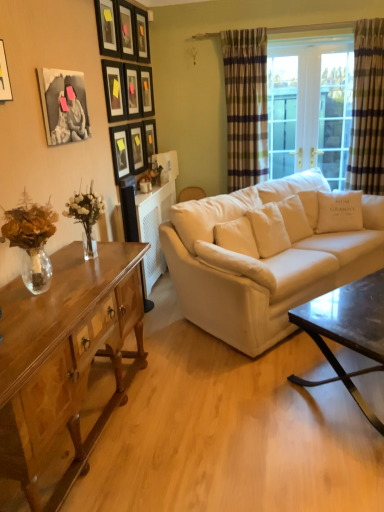
In order to face white cotton cushion at center, the 1th pillow from the right, should I rotate leftwards or rightwards?

Turn right by 19.022 degrees to look at white cotton cushion at center, the 1th pillow from the right.

In order to face matte black picture frame at upper left, marked as the second picture frame in a front-to-back arrangement, should I rotate leftwards or rightwards?

You should rotate left by 10.952 degrees.

What do you see at coordinates (137, 147) in the screenshot? The image size is (384, 512). I see `matte black picture frame at upper center, which ranks as the 4th picture frame in back-to-front order` at bounding box center [137, 147].

The image size is (384, 512). Describe the element at coordinates (150, 138) in the screenshot. I see `matte black picture frame at center, which is the tenth picture frame in front-to-back order` at that location.

Measure the distance between white fabric couch at center and camera.

8.41 feet.

Where is `white cotton cushion at center, marked as the 1th pillow in a back-to-front arrangement`? white cotton cushion at center, marked as the 1th pillow in a back-to-front arrangement is located at coordinates (339, 212).

Does point (134, 98) come behind point (107, 29)?

Yes.

From a real-world perspective, is matte black picture frame at upper center, the fifth picture frame positioned from the back, below matte black picture frame at upper left, marked as the 9th picture frame in a back-to-front arrangement?

Correct, in the physical world, matte black picture frame at upper center, the fifth picture frame positioned from the back, is lower than matte black picture frame at upper left, marked as the 9th picture frame in a back-to-front arrangement.

Is matte black picture frame at upper center, positioned as the sixth picture frame in front-to-back order, wider or thinner than matte black picture frame at upper left, marked as the second picture frame in a front-to-back arrangement?

Clearly, matte black picture frame at upper center, positioned as the sixth picture frame in front-to-back order, has less width compared to matte black picture frame at upper left, marked as the second picture frame in a front-to-back arrangement.

What's the angular difference between matte black picture frame at upper center, positioned as the sixth picture frame in front-to-back order, and matte black picture frame at upper left, marked as the 9th picture frame in a back-to-front arrangement,'s facing directions?

matte black picture frame at upper center, positioned as the sixth picture frame in front-to-back order, and matte black picture frame at upper left, marked as the 9th picture frame in a back-to-front arrangement, are facing 0.00313 degrees away from each other.

Is clear glass door at upper right wider than white cotton cushion at center, the second pillow positioned from the bottom?

In fact, clear glass door at upper right might be narrower than white cotton cushion at center, the second pillow positioned from the bottom.

From a real-world perspective, is clear glass door at upper right over white cotton cushion at center, marked as the 1th pillow in a back-to-front arrangement?

Indeed, from a real-world perspective, clear glass door at upper right stands above white cotton cushion at center, marked as the 1th pillow in a back-to-front arrangement.

Is clear glass door at upper right situated inside white cotton cushion at center, the 1th pillow from the right, or outside?

clear glass door at upper right is not enclosed by white cotton cushion at center, the 1th pillow from the right.

Is clear glass door at upper right facing towards white cotton cushion at center, arranged as the 2th pillow when viewed from the left?

Yes, clear glass door at upper right faces towards white cotton cushion at center, arranged as the 2th pillow when viewed from the left.

Can you tell me how much matte black picture frame at upper center, positioned as the sixth picture frame in front-to-back order, and plaid fabric curtain at right, the 2th curtain viewed from the right, differ in facing direction?

The facing directions of matte black picture frame at upper center, positioned as the sixth picture frame in front-to-back order, and plaid fabric curtain at right, the 2th curtain viewed from the right, are 88.6 degrees apart.

From a real-world perspective, which object rests below the other?

plaid fabric curtain at right, the 2th curtain viewed from the right.

Is matte black picture frame at upper center, positioned as the sixth picture frame in front-to-back order, next to plaid fabric curtain at right, the 2th curtain viewed from the right, and touching it?

No, matte black picture frame at upper center, positioned as the sixth picture frame in front-to-back order, is not beside plaid fabric curtain at right, the 2th curtain viewed from the right.

Between matte black picture frame at upper center, positioned as the sixth picture frame in front-to-back order, and plaid fabric curtain at right, the 2th curtain viewed from the right, which one appears on the left side from the viewer's perspective?

matte black picture frame at upper center, positioned as the sixth picture frame in front-to-back order.

Consider the image. Is matte black picture frame at upper center, positioned as the eighth picture frame in back-to-front order, wider or thinner than matte black picture frame at upper center, the third picture frame from the back?

Considering their sizes, matte black picture frame at upper center, positioned as the eighth picture frame in back-to-front order, looks slimmer than matte black picture frame at upper center, the third picture frame from the back.

Are matte black picture frame at upper center, marked as the third picture frame in a front-to-back arrangement, and matte black picture frame at upper center, the third picture frame from the back, making contact?

matte black picture frame at upper center, marked as the third picture frame in a front-to-back arrangement, and matte black picture frame at upper center, the third picture frame from the back, are clearly separated.

Is matte black picture frame at upper center, marked as the third picture frame in a front-to-back arrangement, oriented away from matte black picture frame at upper center, the third picture frame from the back?

matte black picture frame at upper center, marked as the third picture frame in a front-to-back arrangement, does not have its back to matte black picture frame at upper center, the third picture frame from the back.

Where is `window screen on the right of the matte black picture frame at upper center, which appears as the ninth picture frame when viewed from the front`? window screen on the right of the matte black picture frame at upper center, which appears as the ninth picture frame when viewed from the front is located at coordinates (310, 111).

Based on the photo, is clear glass door at upper right touching matte black picture frame at upper center, which appears as the ninth picture frame when viewed from the front?

clear glass door at upper right and matte black picture frame at upper center, which appears as the ninth picture frame when viewed from the front, are not in contact.

Is clear glass door at upper right oriented towards matte black picture frame at upper center, which is counted as the second picture frame, starting from the back?

No.

Does clear glass door at upper right have a lesser width compared to matte black picture frame at upper center, which is counted as the second picture frame, starting from the back?

Incorrect, the width of clear glass door at upper right is not less than that of matte black picture frame at upper center, which is counted as the second picture frame, starting from the back.

Which is behind, matte black picture frame at upper left, marked as the 9th picture frame in a back-to-front arrangement, or black matte picture frame at upper left, positioned as the 1th picture frame in front-to-back order?

matte black picture frame at upper left, marked as the 9th picture frame in a back-to-front arrangement, is more distant.

Can you confirm if matte black picture frame at upper left, marked as the second picture frame in a front-to-back arrangement, is smaller than black matte picture frame at upper left, positioned as the 1th picture frame in front-to-back order?

Indeed, matte black picture frame at upper left, marked as the second picture frame in a front-to-back arrangement, has a smaller size compared to black matte picture frame at upper left, positioned as the 1th picture frame in front-to-back order.

Locate an element on the screen. picture frame that is the 4th object directly below the matte black picture frame at upper left, marked as the 9th picture frame in a back-to-front arrangement (from a real-world perspective) is located at coordinates (64, 105).

How different are the orientations of matte black picture frame at upper left, marked as the 9th picture frame in a back-to-front arrangement, and black matte picture frame at upper left, the tenth picture frame when ordered from back to front, in degrees?

The facing directions of matte black picture frame at upper left, marked as the 9th picture frame in a back-to-front arrangement, and black matte picture frame at upper left, the tenth picture frame when ordered from back to front, are 2 degrees apart.

Is matte black picture frame at upper center, which is counted as the eighth picture frame, starting from the front, at the back of plaid fabric curtain at right, the 2th curtain viewed from the right?

No, plaid fabric curtain at right, the 2th curtain viewed from the right, is not facing away from matte black picture frame at upper center, which is counted as the eighth picture frame, starting from the front.

Would you say plaid fabric curtain at right, the 2th curtain viewed from the right, is a long distance from matte black picture frame at upper center, which is counted as the eighth picture frame, starting from the front?

plaid fabric curtain at right, the 2th curtain viewed from the right, is positioned a significant distance from matte black picture frame at upper center, which is counted as the eighth picture frame, starting from the front.

From the plaid fabric curtain at right, the 2th curtain viewed from the right, count the 3rd picture frame to the left and point to it. Please provide its 2D coordinates.

[(142, 35)]

Can you confirm if plaid fabric curtain at right, the 2th curtain viewed from the right, is thinner than matte black picture frame at upper center, which is counted as the eighth picture frame, starting from the front?

No, plaid fabric curtain at right, the 2th curtain viewed from the right, is not thinner than matte black picture frame at upper center, which is counted as the eighth picture frame, starting from the front.

From the matte black picture frame at upper center, the fifth picture frame positioned from the back, count 4th picture frames forward and point to it. Please provide its 2D coordinates.

[(107, 27)]

Locate an element on the screen. This screenshot has height=512, width=384. window screen located above the white cotton cushion at center, the second pillow positioned from the bottom (from the image's perspective) is located at coordinates (310, 111).

Considering their positions, is shiny dark wood coffee table at lower right, placed as the 1th coffee table when sorted from right to left, positioned closer to matte black picture frame at upper left, marked as the second picture frame in a front-to-back arrangement, than light brown wooden coffee table at lower left, which appears as the 1th coffee table when viewed from the left?

Based on the image, light brown wooden coffee table at lower left, which appears as the 1th coffee table when viewed from the left, appears to be nearer to matte black picture frame at upper left, marked as the second picture frame in a front-to-back arrangement.

When comparing their distances from white fabric couch at center, does matte black picture frame at upper left, marked as the second picture frame in a front-to-back arrangement, or white cotton cushion at center, marked as the 1th pillow in a back-to-front arrangement, seem closer?

The object closer to white fabric couch at center is white cotton cushion at center, marked as the 1th pillow in a back-to-front arrangement.

Which object lies further to the anchor point matte black picture frame at upper center, which is the 7th picture frame in back-to-front order, light brown fabric armchair at center or matte black picture frame at upper left, marked as the second picture frame in a front-to-back arrangement?

Based on the image, light brown fabric armchair at center appears to be further to matte black picture frame at upper center, which is the 7th picture frame in back-to-front order.

Which object lies nearer to the anchor point clear glass door at upper right, light brown wooden coffee table at lower left, the 2th coffee table from the right, or black matte picture frame at upper left, positioned as the 1th picture frame in front-to-back order?

black matte picture frame at upper left, positioned as the 1th picture frame in front-to-back order, is closer to clear glass door at upper right.

Estimate the real-world distances between objects in this image. Which object is closer to white fabric couch at center, clear glass door at upper right or matte black picture frame at upper left, marked as the 9th picture frame in a back-to-front arrangement?

clear glass door at upper right is closer to white fabric couch at center.

When comparing their distances from matte black picture frame at upper center, marked as the third picture frame in a front-to-back arrangement, does plaid fabric curtain at right, which appears as the 2th curtain when viewed from the left, or matte black picture frame at upper center, which appears as the ninth picture frame when viewed from the front, seem further?

The object further to matte black picture frame at upper center, marked as the third picture frame in a front-to-back arrangement, is plaid fabric curtain at right, which appears as the 2th curtain when viewed from the left.

From the image, which object appears to be nearer to plaid fabric curtain at right, which appears as the 2th curtain when viewed from the left, matte black picture frame at upper center, positioned as the eighth picture frame in back-to-front order, or light brown wooden coffee table at lower left, the 2th coffee table from the right?

Based on the image, matte black picture frame at upper center, positioned as the eighth picture frame in back-to-front order, appears to be nearer to plaid fabric curtain at right, which appears as the 2th curtain when viewed from the left.

From the image, which object appears to be nearer to plaid fabric curtain at right, the 2th curtain viewed from the right, matte black picture frame at upper center, which is counted as the eighth picture frame, starting from the front, or black matte picture frame at upper left, positioned as the 1th picture frame in front-to-back order?

matte black picture frame at upper center, which is counted as the eighth picture frame, starting from the front, lies closer to plaid fabric curtain at right, the 2th curtain viewed from the right, than the other object.

The height and width of the screenshot is (512, 384). What are the coordinates of `pillow situated between matte black picture frame at upper center, which is the 7th picture frame in back-to-front order, and white cotton cushion at center, arranged as the second pillow when viewed from the front, from left to right` in the screenshot? It's located at (236, 264).

At what (x,y) coordinates should I click in order to perform the action: click on armchair between matte black picture frame at upper center, which ranks as the 4th picture frame in back-to-front order, and plaid fabric curtain at right, which appears as the 2th curtain when viewed from the left, from left to right. Please return your answer as a coordinate pair (x, y). This screenshot has width=384, height=512. Looking at the image, I should click on (191, 194).

Image resolution: width=384 pixels, height=512 pixels. I want to click on window screen situated between black matte picture frame at upper left, the tenth picture frame when ordered from back to front, and plaid fabric curtain at right, the 1th curtain when ordered from right to left, from left to right, so click(x=310, y=111).

At what (x,y) coordinates should I click in order to perform the action: click on window screen between matte black picture frame at center, the 1th picture frame positioned from the back, and plaid fabric curtain at right, which appears as the 2th curtain when viewed from the left, from left to right. Please return your answer as a coordinate pair (x, y). Looking at the image, I should click on (310, 111).